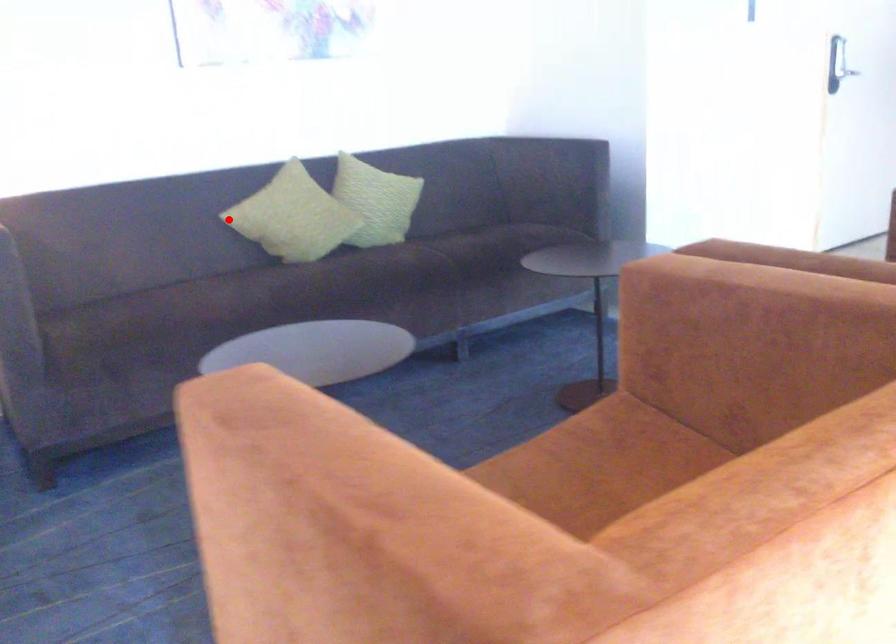
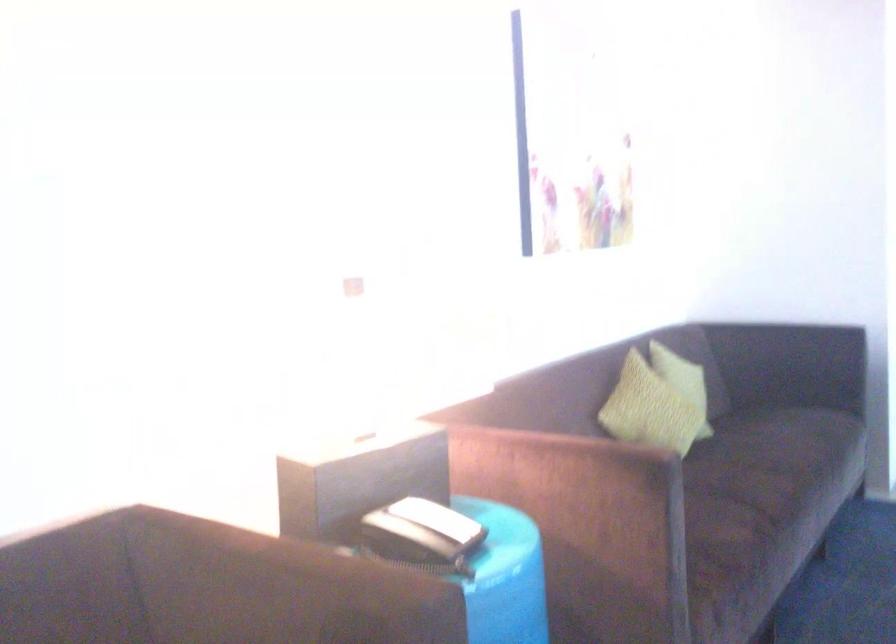
Find the pixel in the second image that matches the highlighted location in the first image.

(648, 410)